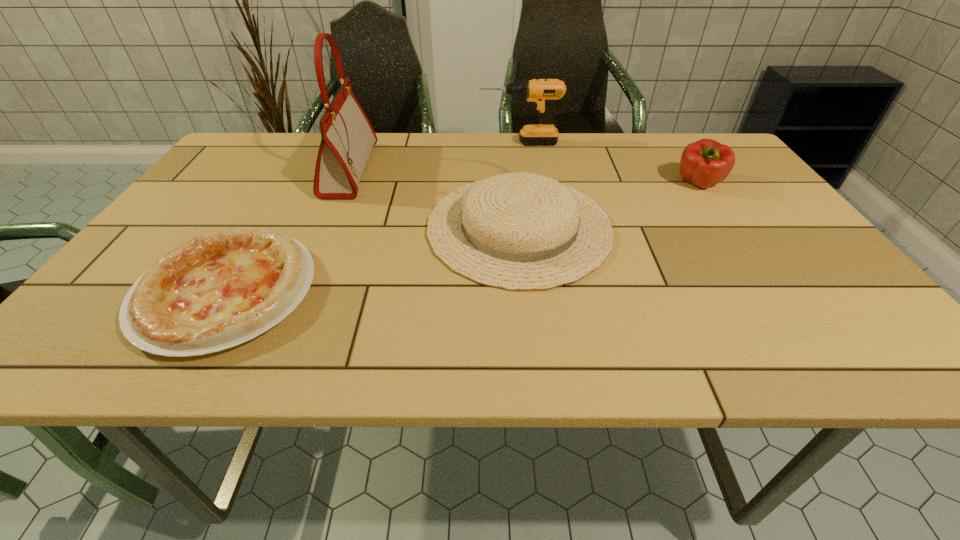
Locate an element on the screen. free point between the fourth tallest object and the third tallest object is located at coordinates (609, 206).

At what (x,y) coordinates should I click in order to perform the action: click on vacant area that lies between the rightmost object and the second shortest object. Please return your answer as a coordinate pair (x, y). Image resolution: width=960 pixels, height=540 pixels. Looking at the image, I should click on (609, 206).

Locate an element on the screen. The width and height of the screenshot is (960, 540). free space between the shortest object and the handbag is located at coordinates (288, 231).

Find the location of a particular element. This screenshot has height=540, width=960. vacant area that lies between the second shortest object and the third shortest object is located at coordinates coord(609,206).

This screenshot has width=960, height=540. What are the coordinates of `unoccupied position between the handbag and the fourth shortest object` in the screenshot? It's located at (435, 157).

You are a GUI agent. You are given a task and a screenshot of the screen. Output one action in this format:
    pyautogui.click(x=<x>, y=<y>)
    Task: Click on the second closest object to the third tallest object
    The width and height of the screenshot is (960, 540).
    Given the screenshot: What is the action you would take?
    pyautogui.click(x=541, y=92)

This screenshot has width=960, height=540. What are the coordinates of `object that stands as the second closest to the sunhat` in the screenshot? It's located at (541, 92).

Locate an element on the screen. blank area in the image that satisfies the following two spatial constraints: 1. on the front side of the handbag; 2. on the right side of the third tallest object is located at coordinates (344, 184).

You are a GUI agent. You are given a task and a screenshot of the screen. Output one action in this format:
    pyautogui.click(x=<x>, y=<y>)
    Task: Click on the vacant space that satisfies the following two spatial constraints: 1. on the front side of the tallest object; 2. on the left side of the fourth tallest object
    This screenshot has height=540, width=960.
    Given the screenshot: What is the action you would take?
    pyautogui.click(x=325, y=227)

Where is `vacant space that satisfies the following two spatial constraints: 1. at the tip of the second tallest object; 2. on the left side of the rightmost object`? The height and width of the screenshot is (540, 960). vacant space that satisfies the following two spatial constraints: 1. at the tip of the second tallest object; 2. on the left side of the rightmost object is located at coordinates (525, 184).